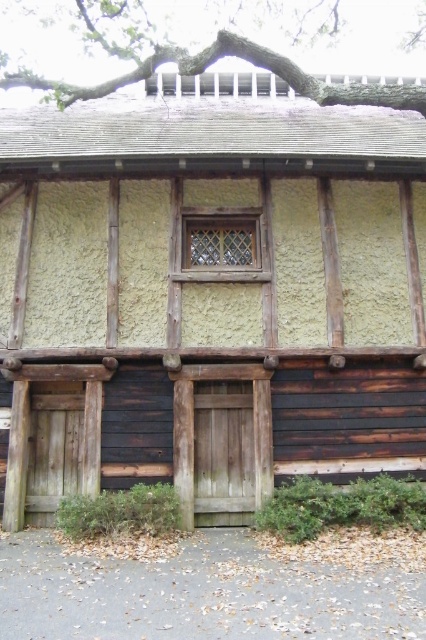
You are standing in front of the half timbered building and see two points marked on the facade. Which point is closer to you, point [150,188] or point [189,230]?

Point [150,188] is in front of point [189,230], so it is closer to you.

You are an architect inspecting the facade of a half timbered building. You notice the rough plaster wall at center and the matte wooden window at center. Which object occupies more horizontal space on the facade?

The rough plaster wall at center occupies more horizontal space than the matte wooden window at center because its width is larger.

The rough plaster wall at center is located at what coordinates?

The rough plaster wall at center is located at coordinates point (209, 292).